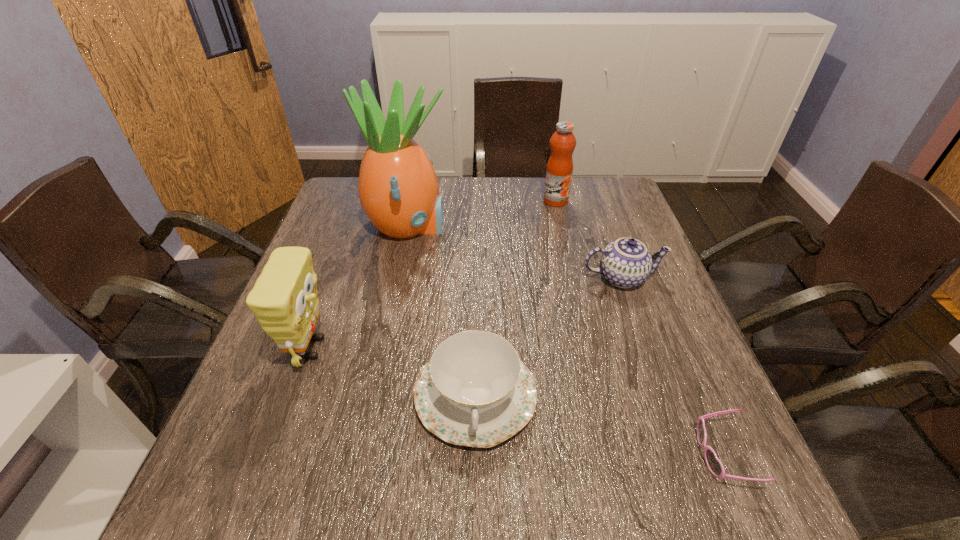
You are a GUI agent. You are given a task and a screenshot of the screen. Output one action in this format:
    pyautogui.click(x=<x>, y=<y>)
    Task: Click on the empty location between the tallest object and the fruit juice
    This screenshot has height=540, width=960.
    Given the screenshot: What is the action you would take?
    pyautogui.click(x=482, y=214)

Where is `free area in between the shorter chinaware and the shortest object`? The width and height of the screenshot is (960, 540). free area in between the shorter chinaware and the shortest object is located at coordinates (599, 425).

At what (x,y) coordinates should I click in order to perform the action: click on unoccupied area between the shorter chinaware and the sponge. Please return your answer as a coordinate pair (x, y). The width and height of the screenshot is (960, 540). Looking at the image, I should click on (394, 372).

Identify the location of blank region between the pineapple and the fruit juice. This screenshot has height=540, width=960. [482, 214].

The width and height of the screenshot is (960, 540). I want to click on vacant space that is in between the sunglasses and the left chinaware, so click(599, 425).

Find the location of a particular element. The image size is (960, 540). empty space between the shortest object and the fruit juice is located at coordinates (639, 328).

The width and height of the screenshot is (960, 540). What are the coordinates of `free spot between the sponge and the fruit juice` in the screenshot? It's located at (434, 274).

You are a GUI agent. You are given a task and a screenshot of the screen. Output one action in this format:
    pyautogui.click(x=<x>, y=<y>)
    Task: Click on the free space between the sponge and the fifth tallest object
    The width and height of the screenshot is (960, 540).
    Given the screenshot: What is the action you would take?
    pyautogui.click(x=394, y=372)

Identify the location of free space between the tallest object and the fruit juice. (482, 214).

Locate which object ranks in proximity to the sponge. Please provide its 2D coordinates. Your answer should be formatted as a tuple, i.e. [(x, y)], where the tuple contains the x and y coordinates of a point satisfying the conditions above.

[(475, 391)]